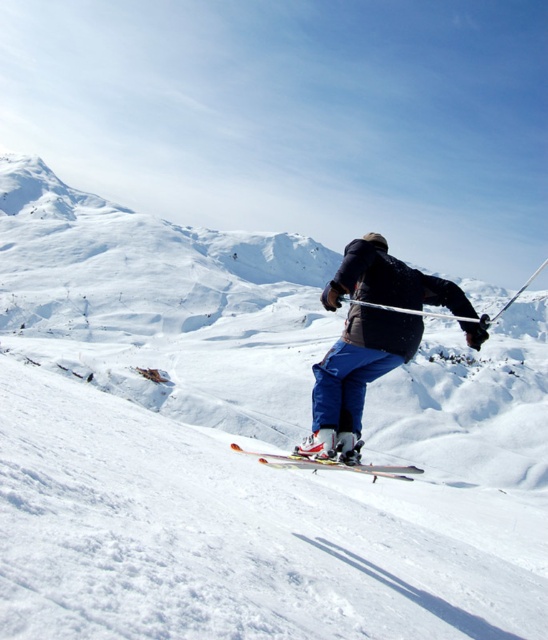
You are a photographer trying to capture the skier in the image. You want to ensure the blue fabric pants at center and the shiny metallic skis at center are both visible in the photo. Based on their positions, which object should appear closer to the camera?

The blue fabric pants at center is in front of the shiny metallic skis at center, so the blue fabric pants at center will appear closer to the camera.

You are a photographer standing at the bottom of the mountain. You want to capture a photo of the skier so that the blue fabric pants at center and the shiny metallic skis at center are both clearly visible in the frame. Given their current distance apart, is it possible to include both in a single photo without zooming in?

The distance between the blue fabric pants at center and the shiny metallic skis at center is 3.46 meters. Since this distance is manageable within a standard camera frame without zooming, both can be captured clearly in the same photo.

You are a photographer trying to capture the skier in the image. You want to ensure both the blue fabric pants at center and the shiny metallic skis at center are clearly visible in your photo. Which object should you focus on first to ensure it doesn t get too small in the frame?

The blue fabric pants at center is smaller than the shiny metallic skis at center, so you should focus on the blue fabric pants at center first to ensure it doesn t get too small in the frame.